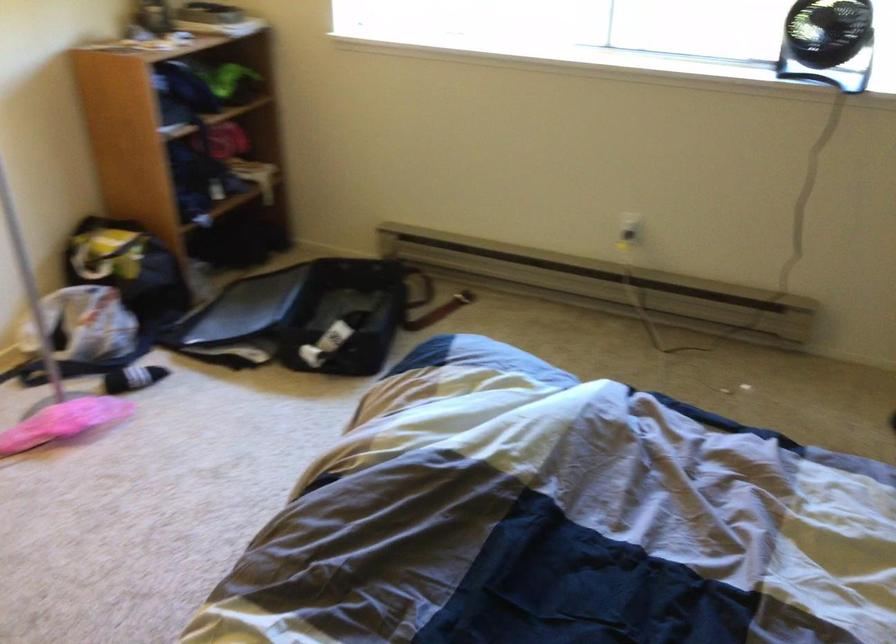
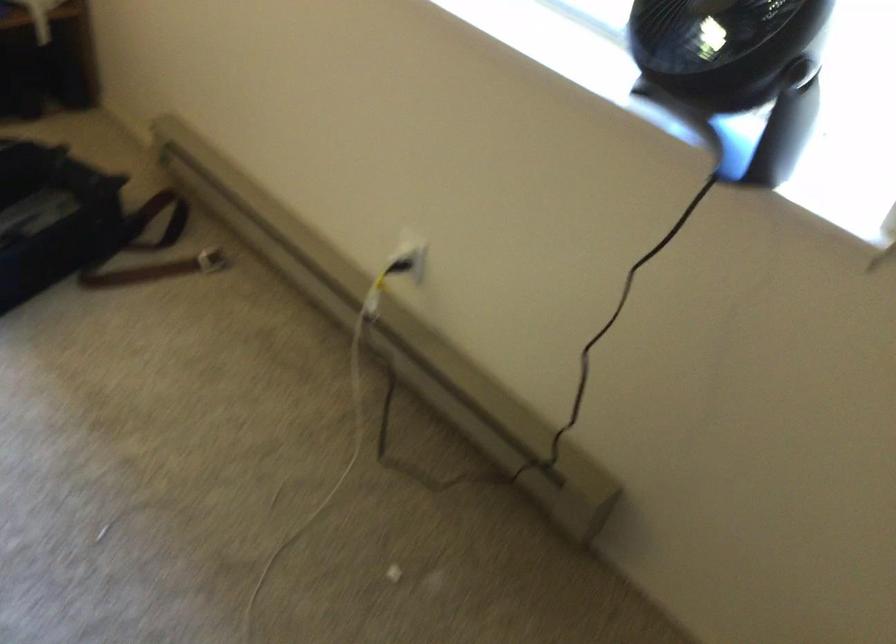
Which direction would the cameraman need to move to produce the second image?

The movement direction of the cameraman is right, forward.